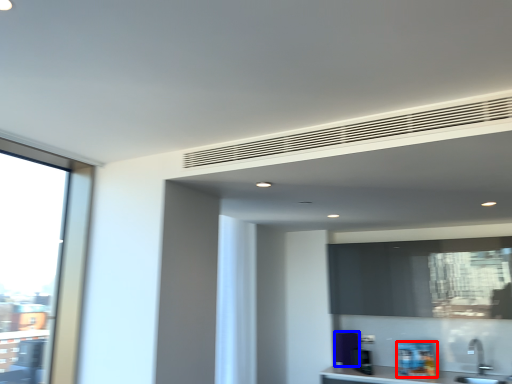
Question: Among these objects, which one is nearest to the camera, appliance (highlighted by a red box) or appliance (highlighted by a blue box)?

Choices:
 (A) appliance
 (B) appliance

Answer: (A)